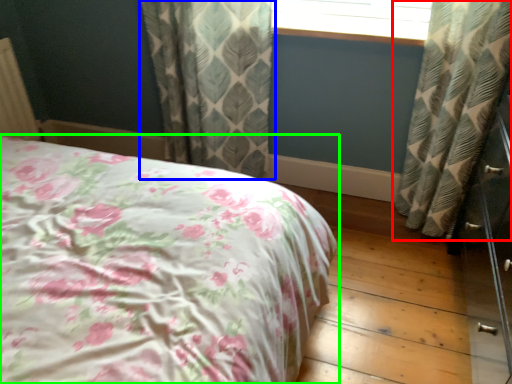
Question: Which is nearer to the curtain (highlighted by a red box)? curtain (highlighted by a blue box) or bed (highlighted by a green box).

Choices:
 (A) curtain
 (B) bed

Answer: (A)